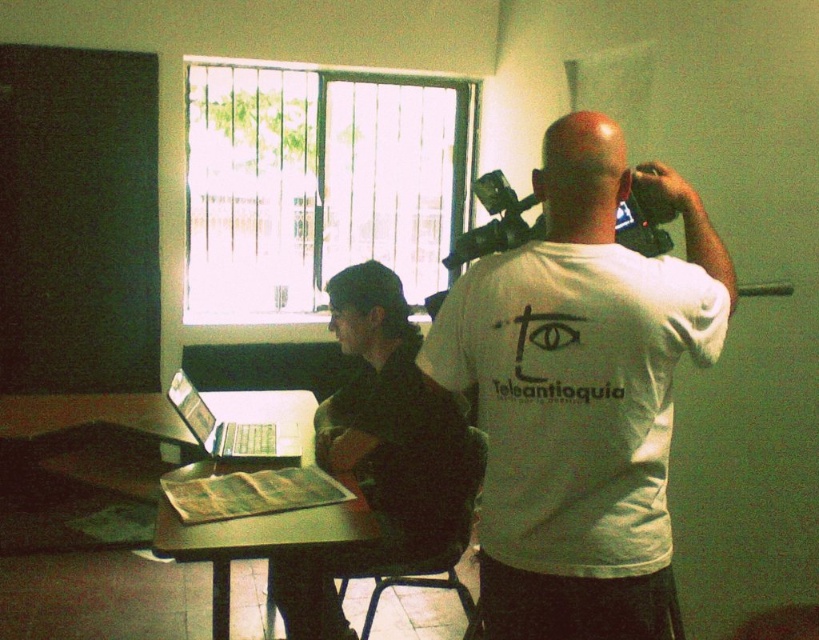
Question: Which point is closer to the camera?

Choices:
 (A) silver metallic laptop at center
 (B) dark green fabric shirt at center

Answer: (B)

Question: Can you confirm if white cotton shirt at center is positioned below dark green fabric shirt at center?

Choices:
 (A) yes
 (B) no

Answer: (B)

Question: Estimate the real-world distances between objects in this image. Which object is closer to the black plastic video camera at upper center?

Choices:
 (A) silver metallic laptop at center
 (B) wooden table at center
 (C) white cotton shirt at center

Answer: (C)

Question: Is white cotton shirt at center positioned before wooden table at center?

Choices:
 (A) yes
 (B) no

Answer: (A)

Question: Which point appears farthest from the camera in this image?

Choices:
 (A) (292, 438)
 (B) (631, 477)

Answer: (A)

Question: Is white cotton shirt at center to the right of wooden table at center from the viewer's perspective?

Choices:
 (A) no
 (B) yes

Answer: (B)